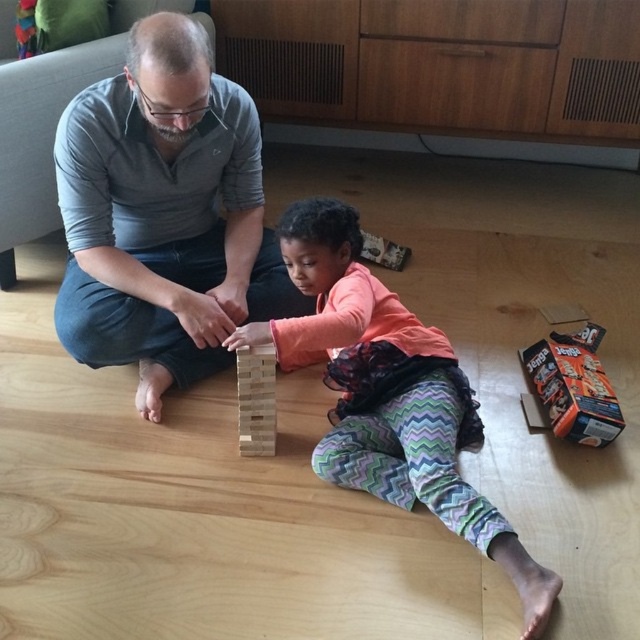
Question: Does orange cardboard box at lower right appear under wooden block at center?

Choices:
 (A) no
 (B) yes

Answer: (A)

Question: Which of the following is the closest to the observer?

Choices:
 (A) (240, 380)
 (B) (337, 276)
 (C) (540, 376)

Answer: (A)

Question: Observing the image, what is the correct spatial positioning of orange cardboard box at lower right in reference to wooden block at center?

Choices:
 (A) right
 (B) left

Answer: (A)

Question: Which is farther from the orange cardboard box at lower right?

Choices:
 (A) matte gray shirt at upper left
 (B) matte wooden blocks at center

Answer: (A)

Question: Is matte gray shirt at upper left wider than wooden block at center?

Choices:
 (A) no
 (B) yes

Answer: (B)

Question: Among these points, which one is nearest to the camera?

Choices:
 (A) (552, 394)
 (B) (246, 404)
 (C) (317, 356)
 (D) (124, 180)

Answer: (B)